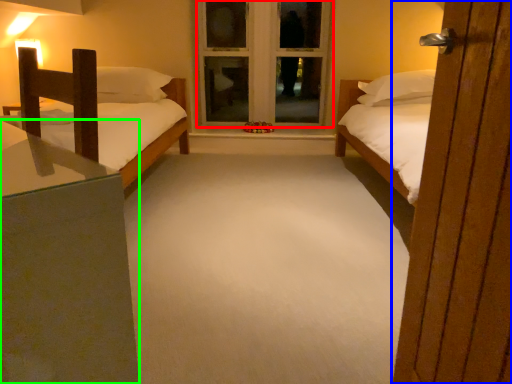
Question: Based on their relative distances, which object is nearer to window frame (highlighted by a red box)? Choose from door (highlighted by a blue box) and nightstand (highlighted by a green box).

Choices:
 (A) door
 (B) nightstand

Answer: (A)